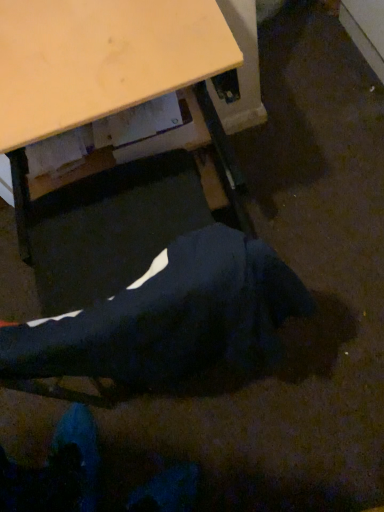
Question: Is wooden desk at center situated inside black fabric robe at lower center or outside?

Choices:
 (A) inside
 (B) outside

Answer: (B)

Question: Is wooden desk at center in front of or behind black fabric robe at lower center in the image?

Choices:
 (A) front
 (B) behind

Answer: (B)

Question: From a real-world perspective, relative to black fabric robe at lower center, is wooden desk at center vertically above or below?

Choices:
 (A) above
 (B) below

Answer: (B)

Question: In the image, is black fabric robe at lower center on the left side or the right side of wooden desk at center?

Choices:
 (A) right
 (B) left

Answer: (A)

Question: In terms of height, does black fabric robe at lower center look taller or shorter compared to wooden desk at center?

Choices:
 (A) short
 (B) tall

Answer: (A)

Question: From the image's perspective, is black fabric robe at lower center positioned above or below wooden desk at center?

Choices:
 (A) above
 (B) below

Answer: (B)

Question: Is black fabric robe at lower center bigger or smaller than wooden desk at center?

Choices:
 (A) small
 (B) big

Answer: (A)